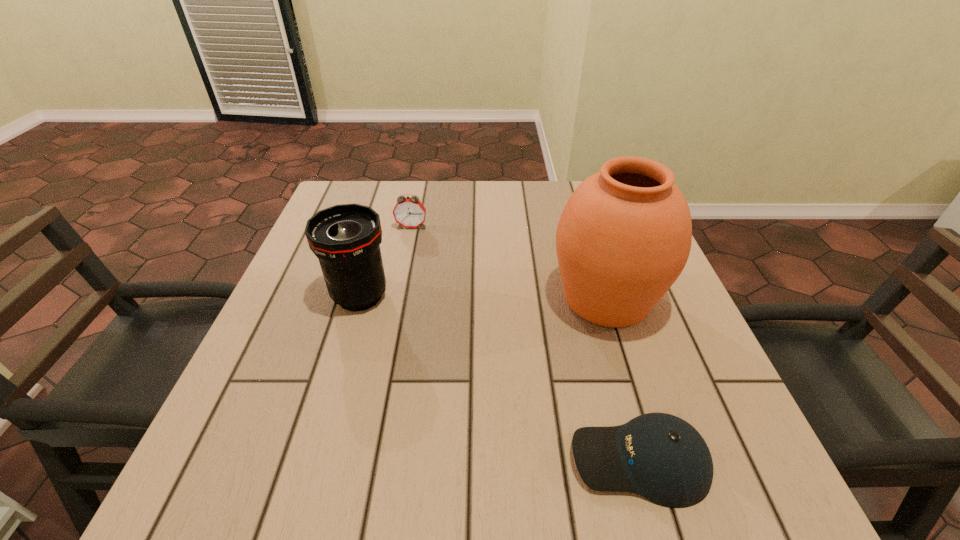
The width and height of the screenshot is (960, 540). Identify the location of vacant region at the right edge of the desktop. (671, 291).

Locate an element on the screen. This screenshot has height=540, width=960. free space at the near left corner of the desktop is located at coordinates (285, 509).

Where is `vacant area that lies between the third tallest object and the third shortest object`? The height and width of the screenshot is (540, 960). vacant area that lies between the third tallest object and the third shortest object is located at coordinates (386, 261).

The image size is (960, 540). What are the coordinates of `vacant area between the alarm clock and the telephoto lens` in the screenshot? It's located at (386, 261).

At what (x,y) coordinates should I click in order to perform the action: click on free point between the shortest object and the telephoto lens. Please return your answer as a coordinate pair (x, y). This screenshot has height=540, width=960. Looking at the image, I should click on coord(499,379).

Where is `free space between the second shortest object and the telephoto lens`? This screenshot has width=960, height=540. free space between the second shortest object and the telephoto lens is located at coordinates (386, 261).

Identify the location of free space that is in between the telephoto lens and the urn. The width and height of the screenshot is (960, 540). (483, 297).

At what (x,y) coordinates should I click in order to perform the action: click on vacant space that is in between the second tallest object and the urn. Please return your answer as a coordinate pair (x, y). Image resolution: width=960 pixels, height=540 pixels. Looking at the image, I should click on pos(483,297).

Locate an element on the screen. unoccupied area between the tallest object and the alarm clock is located at coordinates (509, 262).

Locate an element on the screen. free space between the farthest object and the nearest object is located at coordinates (525, 343).